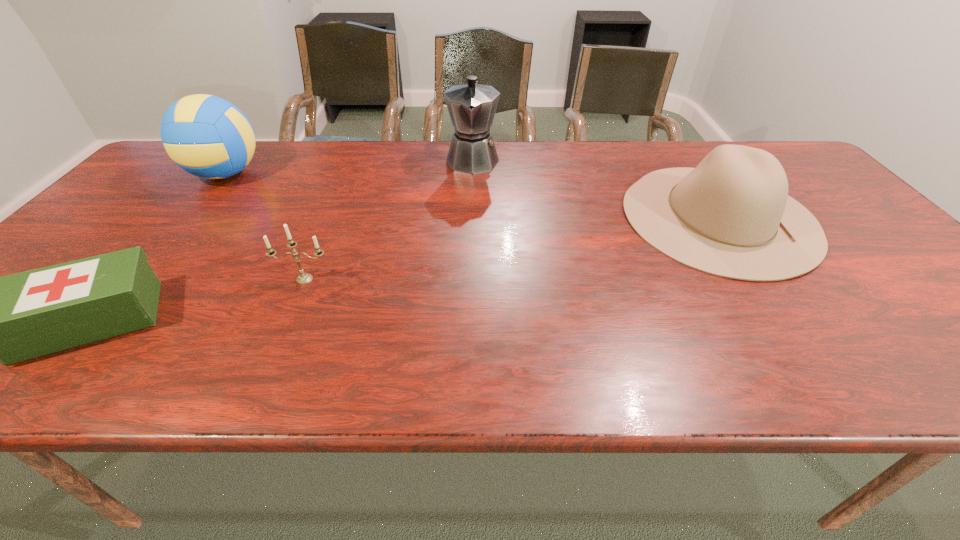
Find the location of a particular element. the fourth object from left to right is located at coordinates (471, 106).

Where is `volleyball`? volleyball is located at coordinates (207, 136).

This screenshot has height=540, width=960. Find the location of `the rightmost object`. the rightmost object is located at coordinates 731,216.

Identify the location of sombrero. The height and width of the screenshot is (540, 960). (731, 216).

At what (x,y) coordinates should I click in order to perform the action: click on the third object from left to right. Please return your answer as a coordinate pair (x, y). The height and width of the screenshot is (540, 960). Looking at the image, I should click on (303, 278).

The height and width of the screenshot is (540, 960). I want to click on candle, so click(303, 278).

Identify the location of vacant region located 0.240m at the spout of the coffeepot. The image size is (960, 540). (471, 227).

This screenshot has height=540, width=960. What are the coordinates of `blank space located 0.130m on the right of the volleyball` in the screenshot? It's located at (307, 174).

Locate an element on the screen. The width and height of the screenshot is (960, 540). free space located 0.090m on the back of the rightmost object is located at coordinates (677, 155).

Locate an element on the screen. The width and height of the screenshot is (960, 540). vacant space located 0.390m on the back of the candle is located at coordinates (346, 183).